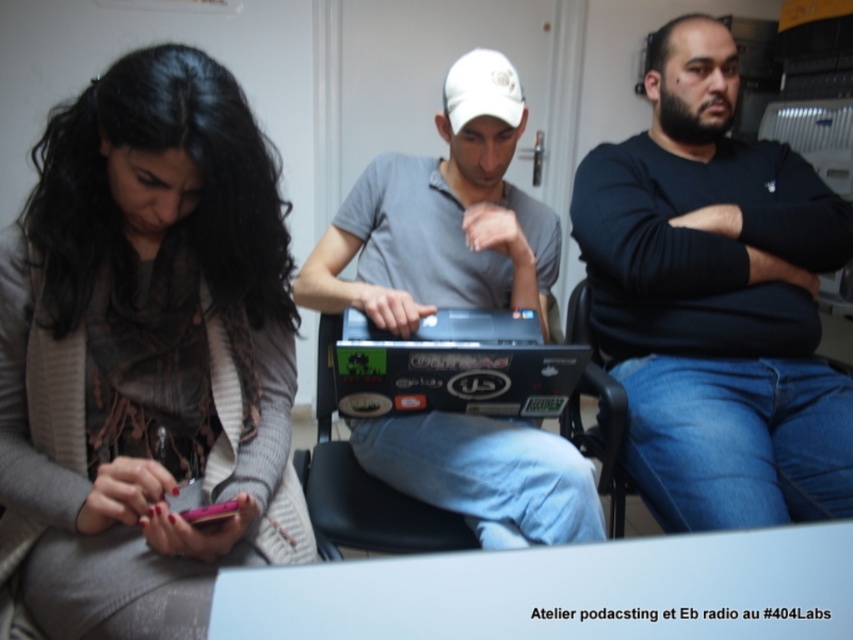
Which of these two, gray matte shirt at center or black plastic chair at center, stands taller?

Standing taller between the two is gray matte shirt at center.

The image size is (853, 640). Find the location of `gray matte shirt at center`. gray matte shirt at center is located at coordinates (442, 218).

You are a GUI agent. You are given a task and a screenshot of the screen. Output one action in this format:
    pyautogui.click(x=<x>, y=<y>)
    Task: Click on the gray matte shirt at center
    This screenshot has width=853, height=640.
    Given the screenshot: What is the action you would take?
    pyautogui.click(x=442, y=218)

Is black matte shirt at center to the right of gray matte shirt at center from the viewer's perspective?

Correct, you'll find black matte shirt at center to the right of gray matte shirt at center.

What do you see at coordinates (717, 301) in the screenshot?
I see `black matte shirt at center` at bounding box center [717, 301].

Who is more forward, (695,275) or (389,195)?

Point (695,275) is more forward.

Find the location of `black matte shirt at center`. black matte shirt at center is located at coordinates (717, 301).

Does black matte shirt at center have a greater height compared to black plastic chair at center?

Yes.

Does black matte shirt at center have a greater width compared to black plastic chair at center?

Yes.

Does point (840, 385) come behind point (396, 525)?

Yes, it is.

At what (x,y) coordinates should I click in order to perform the action: click on black matte shirt at center. Please return your answer as a coordinate pair (x, y). The width and height of the screenshot is (853, 640). Looking at the image, I should click on (717, 301).